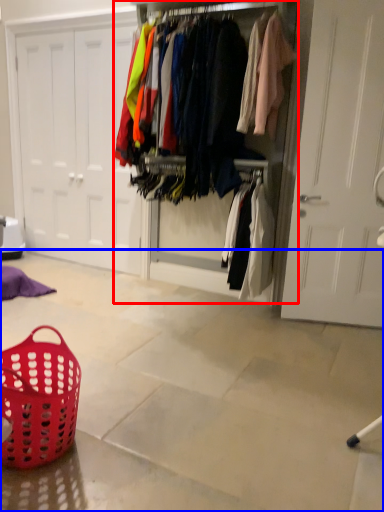
Question: Which object is closer to the camera taking this photo, closet (highlighted by a red box) or concrete (highlighted by a blue box)?

Choices:
 (A) closet
 (B) concrete

Answer: (B)